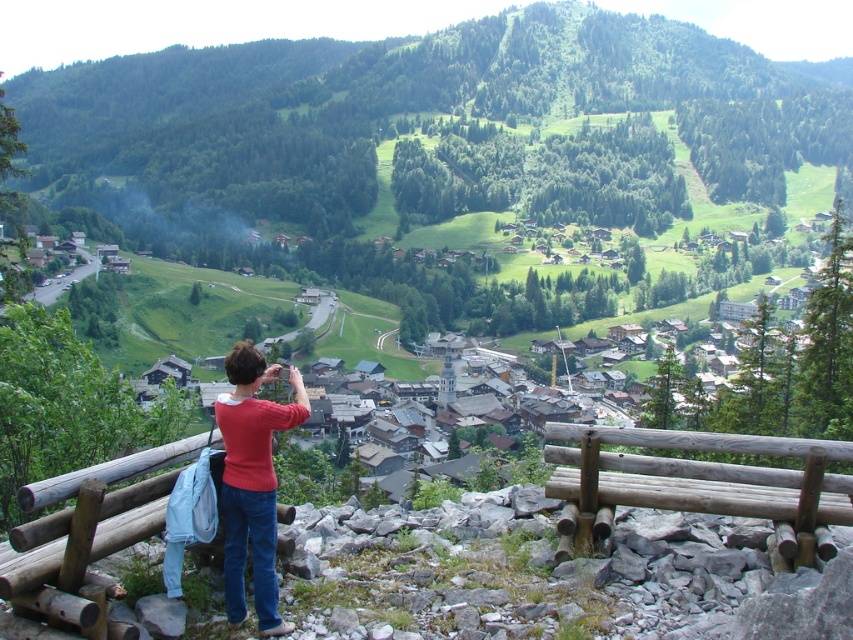
Question: Among these objects, which one is farthest from the camera?

Choices:
 (A) matte red sweater at center
 (B) brown wooden bench at lower center

Answer: (A)

Question: Which of the following is the closest to the observer?

Choices:
 (A) (808, 493)
 (B) (260, 502)

Answer: (A)

Question: Is brown wooden bench at lower center positioned in front of matte red sweater at center?

Choices:
 (A) yes
 (B) no

Answer: (A)

Question: Is brown wooden bench at lower center further to camera compared to matte red sweater at center?

Choices:
 (A) no
 (B) yes

Answer: (A)

Question: Can you confirm if brown wooden bench at lower center is positioned to the left of matte red sweater at center?

Choices:
 (A) no
 (B) yes

Answer: (A)